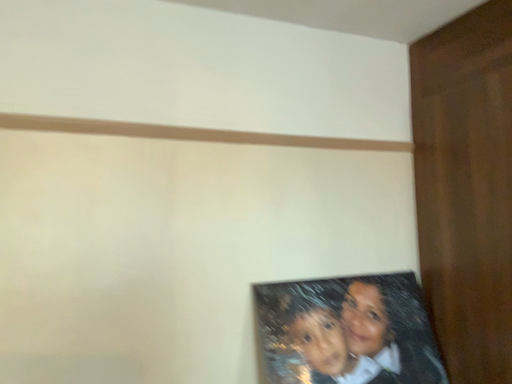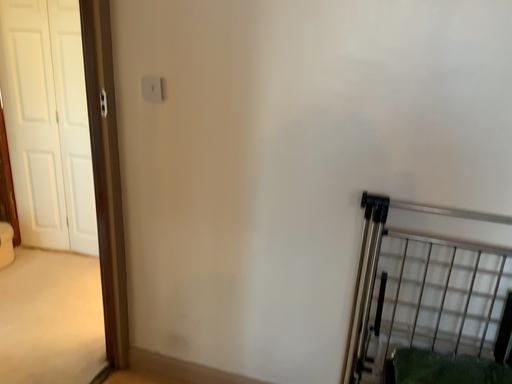
Question: How did the camera likely rotate when shooting the video?

Choices:
 (A) rotated left
 (B) rotated right

Answer: (A)